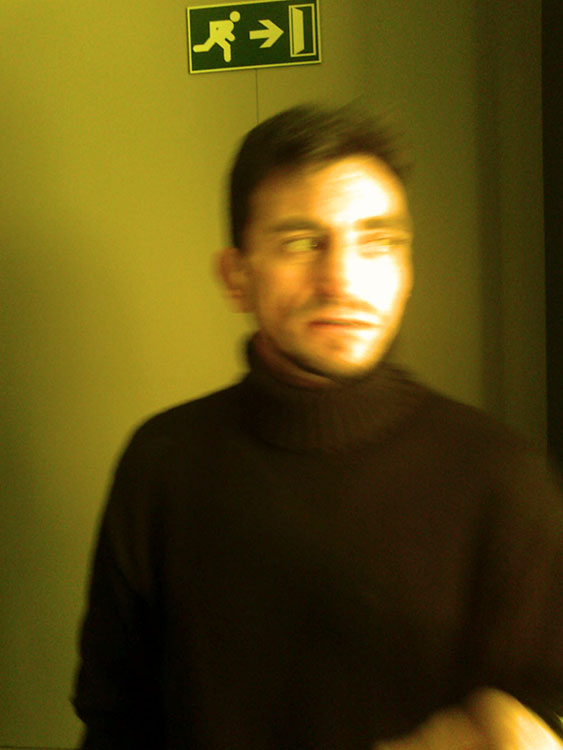
Locate an element on the screen. wall with yellow tint is located at coordinates (108, 130).